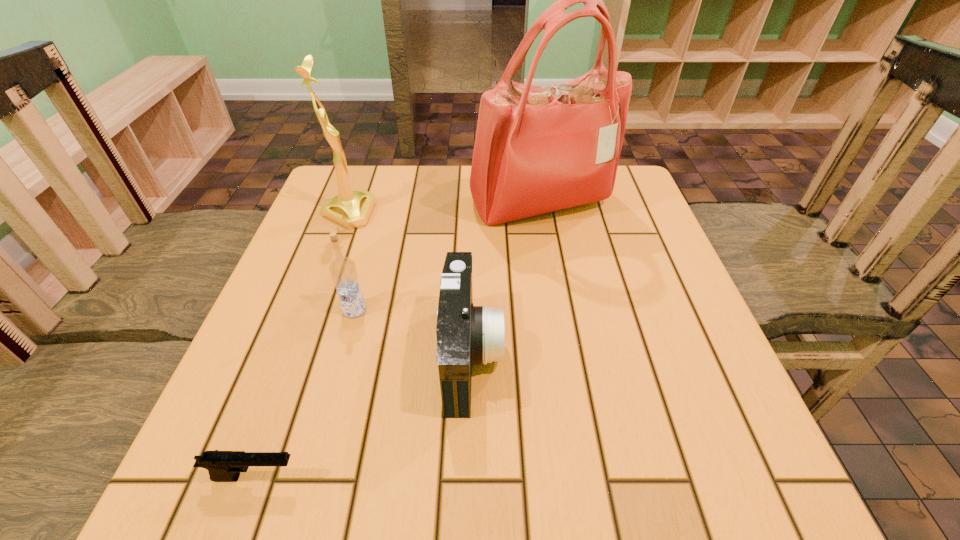
At what (x,y) coordinates should I click in order to perform the action: click on vacant space that satisfies the following two spatial constraints: 1. on the front-facing side of the tallest object; 2. on the front-facing side of the pistol. Please return your answer as a coordinate pair (x, y). Image resolution: width=960 pixels, height=540 pixels. Looking at the image, I should click on (587, 477).